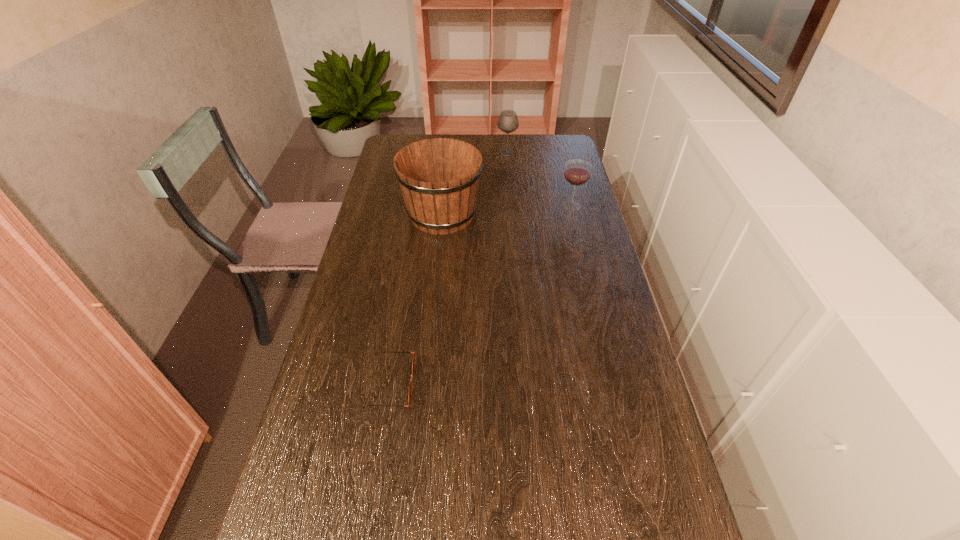
Identify the location of free area in between the tallest object and the shortest object. The width and height of the screenshot is (960, 540). [417, 299].

Locate an element on the screen. The height and width of the screenshot is (540, 960). vacant region between the sunglasses and the tallest object is located at coordinates (417, 299).

Identify the location of empty space that is in between the farthest object and the nearer wineglass. This screenshot has width=960, height=540. (540, 179).

Identify the location of unoccupied area between the shortest object and the tallest object. The width and height of the screenshot is (960, 540). (417, 299).

This screenshot has height=540, width=960. I want to click on free spot between the nearer wineglass and the farthest object, so click(x=540, y=179).

Locate an element on the screen. The height and width of the screenshot is (540, 960). free space between the sunglasses and the wine bucket is located at coordinates (417, 299).

Locate an element on the screen. free space that is in between the wine bucket and the nearest object is located at coordinates (417, 299).

Where is `vacant area that lies between the nearest object and the right wineglass`? vacant area that lies between the nearest object and the right wineglass is located at coordinates (482, 294).

The width and height of the screenshot is (960, 540). I want to click on vacant space that is in between the rightmost object and the nearest object, so click(482, 294).

Where is `the closest object to the nearest object`? The width and height of the screenshot is (960, 540). the closest object to the nearest object is located at coordinates (439, 177).